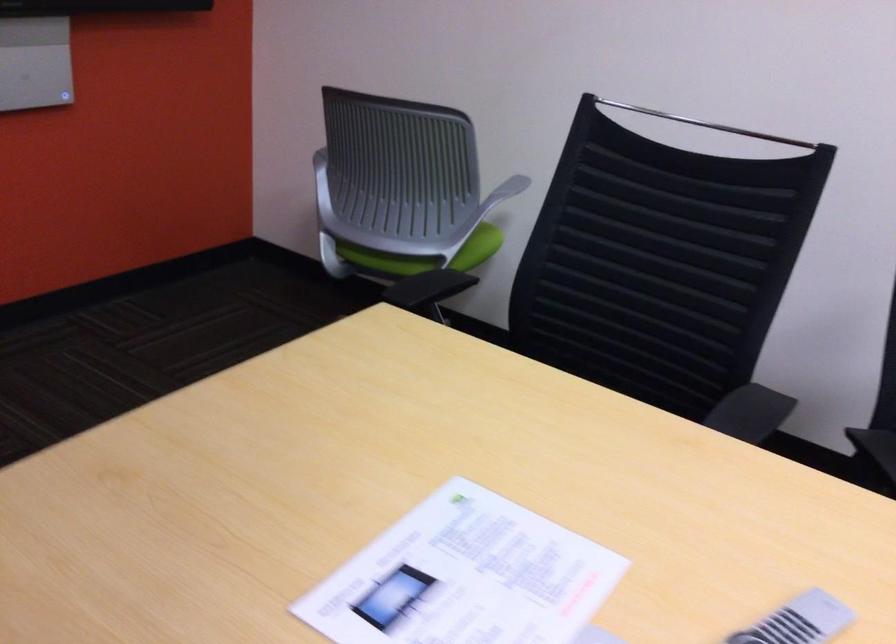
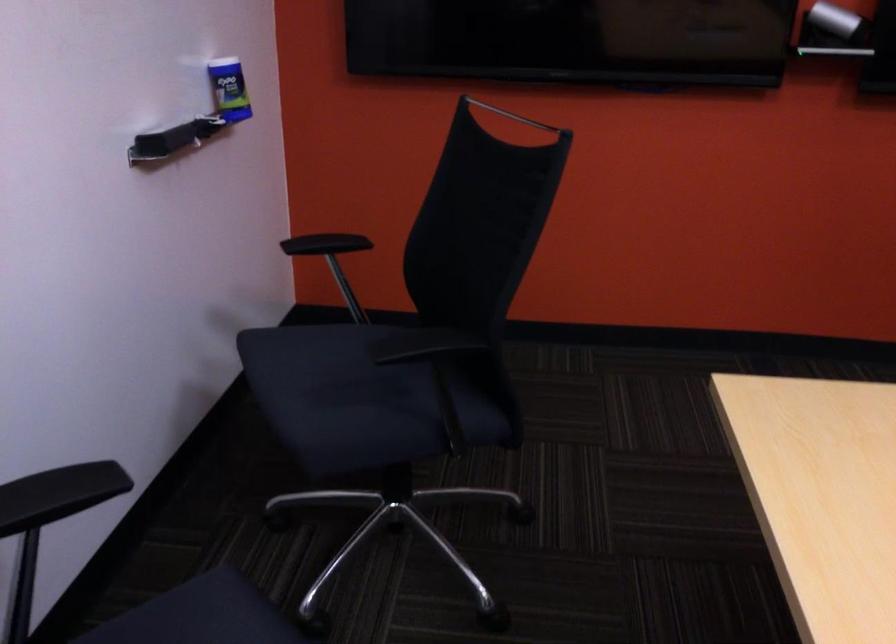
Question: The camera is either moving clockwise (left) or counter-clockwise (right) around the object. The first image is from the beginning of the video and the second image is from the end. Is the camera moving left or right when shooting the video?

Choices:
 (A) Left
 (B) Right

Answer: (B)